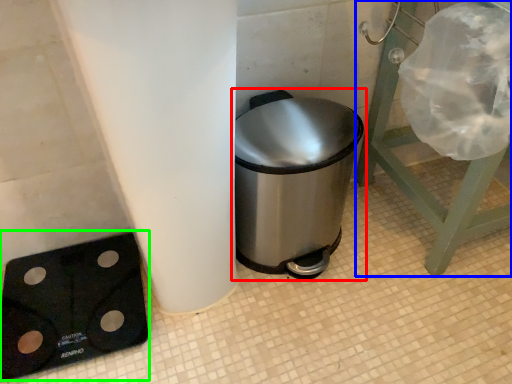
Question: Based on their relative distances, which object is farther from waste container (highlighted by a red box)? Choose from furniture (highlighted by a blue box) and weight scale (highlighted by a green box).

Choices:
 (A) furniture
 (B) weight scale

Answer: (B)